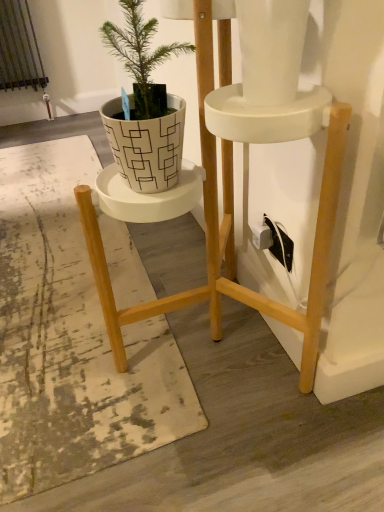
Question: Are white textured mat at center and white geometric-patterned pot at center-left far apart?

Choices:
 (A) no
 (B) yes

Answer: (A)

Question: From a real-world perspective, is white textured mat at center on white geometric-patterned pot at center-left?

Choices:
 (A) yes
 (B) no

Answer: (B)

Question: Could white geometric-patterned pot at center-left be considered to be inside white textured mat at center?

Choices:
 (A) no
 (B) yes

Answer: (A)

Question: Is white textured mat at center smaller than white geometric-patterned pot at center-left?

Choices:
 (A) no
 (B) yes

Answer: (A)

Question: From a real-world perspective, does white textured mat at center sit lower than white geometric-patterned pot at center-left?

Choices:
 (A) yes
 (B) no

Answer: (A)

Question: Is white textured mat at center taller than white geometric-patterned pot at center-left?

Choices:
 (A) no
 (B) yes

Answer: (A)

Question: Can we say white geometric-patterned pot at center-left lies outside white textured mat at center?

Choices:
 (A) yes
 (B) no

Answer: (A)

Question: Is white geometric-patterned pot at center-left bigger than white textured mat at center?

Choices:
 (A) no
 (B) yes

Answer: (A)

Question: From the image's perspective, is white geometric-patterned pot at center-left on white textured mat at center?

Choices:
 (A) no
 (B) yes

Answer: (B)

Question: Is white geometric-patterned pot at center-left positioned with its back to white textured mat at center?

Choices:
 (A) no
 (B) yes

Answer: (A)

Question: Could you tell me if white geometric-patterned pot at center-left is turned towards white textured mat at center?

Choices:
 (A) no
 (B) yes

Answer: (A)

Question: Is the depth of white geometric-patterned pot at center-left less than that of white textured mat at center?

Choices:
 (A) yes
 (B) no

Answer: (A)

Question: From a real-world perspective, is white textured mat at center positioned above or below white geometric-patterned pot at center-left?

Choices:
 (A) below
 (B) above

Answer: (A)